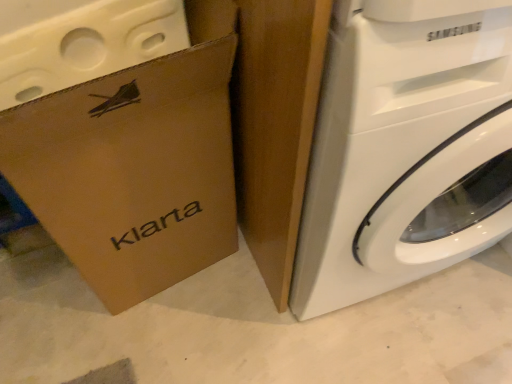
This screenshot has width=512, height=384. In order to click on white glossy washing machine at right in this screenshot , I will do `click(406, 148)`.

Describe the element at coordinates (406, 148) in the screenshot. This screenshot has width=512, height=384. I see `white glossy washing machine at right` at that location.

Find the location of a particular element. brown cardboard box at left is located at coordinates (133, 172).

What do you see at coordinates (133, 172) in the screenshot? Image resolution: width=512 pixels, height=384 pixels. I see `brown cardboard box at left` at bounding box center [133, 172].

Measure the distance between point (159,229) and camera.

Point (159,229) is 36.18 inches from camera.

At what (x,y) coordinates should I click in order to perform the action: click on white glossy washing machine at right. Please return your answer as a coordinate pair (x, y). Looking at the image, I should click on (406, 148).

Which is more to the left, brown cardboard box at left or white glossy washing machine at right?

brown cardboard box at left is more to the left.

Does brown cardboard box at left come in front of white glossy washing machine at right?

No, it is behind white glossy washing machine at right.

Between point (176, 280) and point (504, 186), which one is positioned behind?

The point (176, 280) is more distant.

From the image's perspective, is brown cardboard box at left over white glossy washing machine at right?

No.

From a real-world perspective, is brown cardboard box at left on white glossy washing machine at right?

No, from a real-world perspective, brown cardboard box at left is not on top of white glossy washing machine at right.

Looking at their sizes, would you say brown cardboard box at left is wider or thinner than white glossy washing machine at right?

In the image, brown cardboard box at left appears to be more narrow than white glossy washing machine at right.

Which of these two, brown cardboard box at left or white glossy washing machine at right, stands shorter?

brown cardboard box at left is shorter.

Considering the relative sizes of brown cardboard box at left and white glossy washing machine at right in the image provided, is brown cardboard box at left bigger than white glossy washing machine at right?

A: Incorrect, brown cardboard box at left is not larger than white glossy washing machine at right.

Is brown cardboard box at left located outside white glossy washing machine at right?

Absolutely, brown cardboard box at left is external to white glossy washing machine at right.

Is brown cardboard box at left directly adjacent to white glossy washing machine at right?

brown cardboard box at left is not next to white glossy washing machine at right, and they're not touching.

Could you tell me if brown cardboard box at left is facing white glossy washing machine at right?

No, brown cardboard box at left is not facing towards white glossy washing machine at right.

The image size is (512, 384). Identify the location of washing machine in front of the brown cardboard box at left. (406, 148).

Which is more to the right, white glossy washing machine at right or brown cardboard box at left?

white glossy washing machine at right is more to the right.

Which object is closer to the camera, white glossy washing machine at right or brown cardboard box at left?

white glossy washing machine at right is closer to the camera.

Is point (462, 27) positioned after point (167, 220)?

No, (462, 27) is closer to viewer.

From the image's perspective, relative to brown cardboard box at left, is white glossy washing machine at right above or below?

From the image's perspective, white glossy washing machine at right appears above brown cardboard box at left.

From a real-world perspective, which object rests below the other?

brown cardboard box at left is physically lower.

Considering the relative sizes of white glossy washing machine at right and brown cardboard box at left in the image provided, is white glossy washing machine at right wider than brown cardboard box at left?

Yes.

From their relative heights in the image, would you say white glossy washing machine at right is taller or shorter than brown cardboard box at left?

In the image, white glossy washing machine at right appears to be taller than brown cardboard box at left.

Does white glossy washing machine at right have a larger size compared to brown cardboard box at left?

Yes, white glossy washing machine at right is bigger than brown cardboard box at left.

Which is correct: white glossy washing machine at right is inside brown cardboard box at left, or outside of it?

The correct answer is: outside.

Are white glossy washing machine at right and brown cardboard box at left beside each other?

No, white glossy washing machine at right is not making contact with brown cardboard box at left.

Is brown cardboard box at left at the back of white glossy washing machine at right?

white glossy washing machine at right does not have its back to brown cardboard box at left.

The width and height of the screenshot is (512, 384). What are the coordinates of `cardboard box located underneath the white glossy washing machine at right (from a real-world perspective)` in the screenshot? It's located at (133, 172).

Where is `cardboard box located on the left of white glossy washing machine at right`? cardboard box located on the left of white glossy washing machine at right is located at coordinates (133, 172).

Find the location of `washing machine above the brown cardboard box at left (from a real-world perspective)`. washing machine above the brown cardboard box at left (from a real-world perspective) is located at coordinates (406, 148).